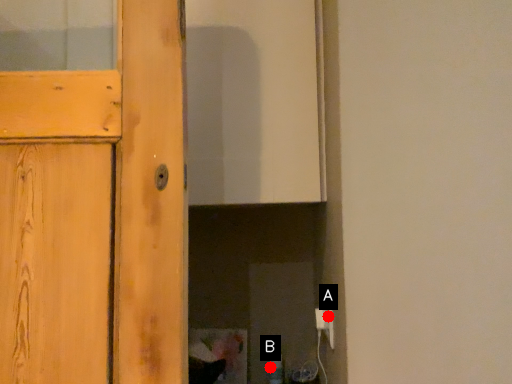
Question: Two points are circled on the image, labeled by A and B beside each circle. Among these points, which one is nearest to the camera?

Choices:
 (A) A is closer
 (B) B is closer

Answer: (A)